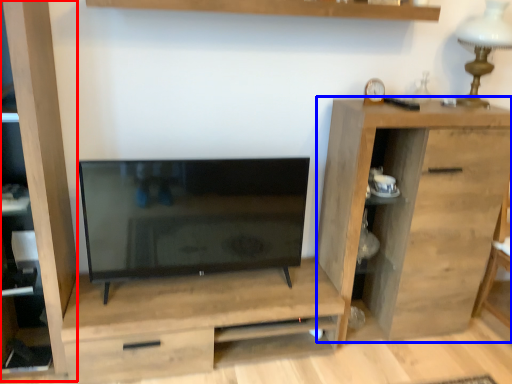
Question: Which point is further to the camera, cabinet (highlighted by a red box) or chest of drawers (highlighted by a blue box)?

Choices:
 (A) cabinet
 (B) chest of drawers

Answer: (B)